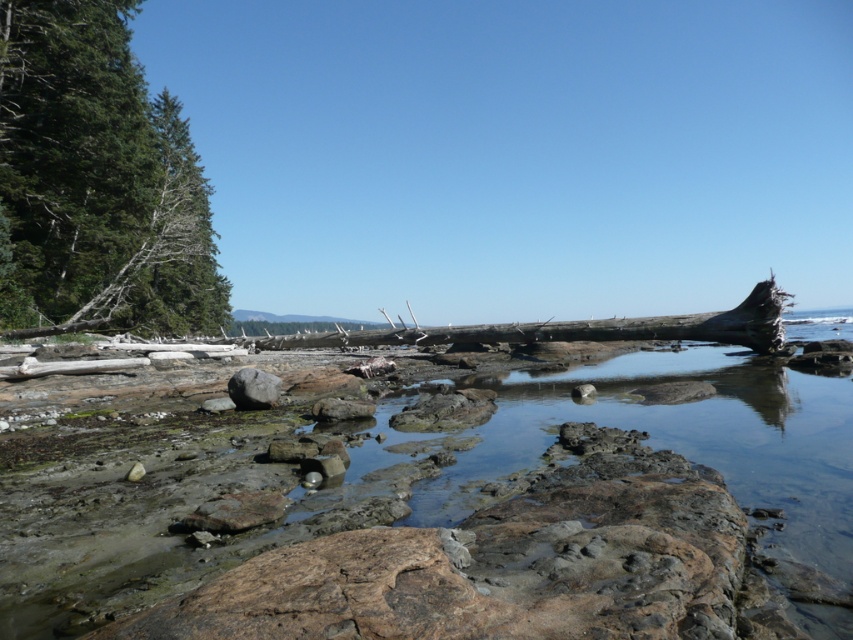
Based on the photo, you are standing at the shoreline looking towards the trees. Which object is closer to your left side, the green rough bark tree at left or the gray smooth rock at center?

The green rough bark tree at left is closer to your left side since it is positioned on the left side of the gray smooth rock at center.

You are a hiker who wants to cross the rocky shoreline. You see the green rough bark tree at left and the gray smooth rock at center. Which object has a wider base to step on?

The green rough bark tree at left has a wider base than the gray smooth rock at center, so it provides a wider surface to step on.